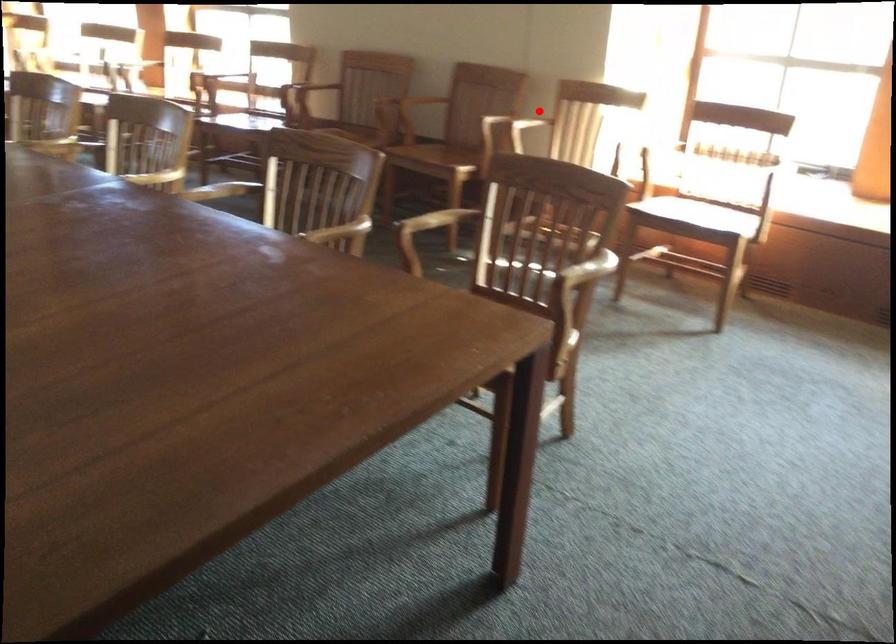
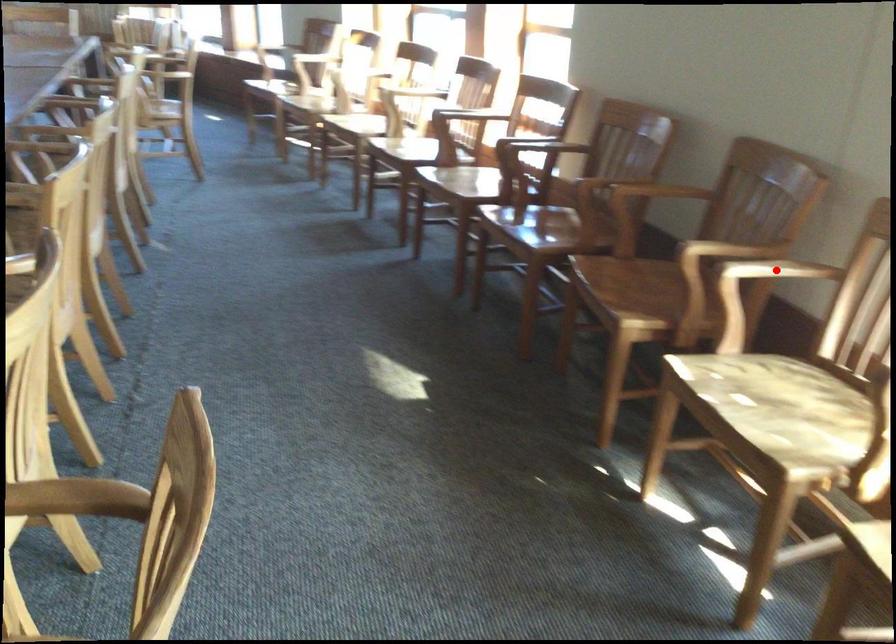
I am providing you with two images of the same scene from different viewpoints. A red point is marked on the first image and another point is marked on the second image. Is the marked point in image1 the same physical position as the marked point in image2?

Yes